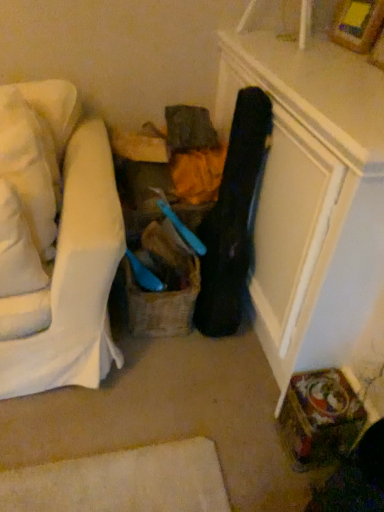
What are the coordinates of `black leather guitar case at center` in the screenshot? It's located at (232, 218).

What do you see at coordinates (357, 24) in the screenshot? The height and width of the screenshot is (512, 384). I see `wooden picture frame at upper right` at bounding box center [357, 24].

In order to face white soft pillow at left, which is the 1th pillow from back to front, should I rotate leftwards or rightwards?

Rotate your view left by about 20.834°.

The width and height of the screenshot is (384, 512). Describe the element at coordinates (17, 248) in the screenshot. I see `white fabric pillow at left, arranged as the first pillow when viewed from the front` at that location.

Find the location of a particular element. The height and width of the screenshot is (512, 384). black leather guitar case at center is located at coordinates (232, 218).

Is white soft pillow at left, which is the 1th pillow from back to front, in front of or behind wooden picture frame at upper right in the image?

In the image, white soft pillow at left, which is the 1th pillow from back to front, appears in front of wooden picture frame at upper right.

How different are the orientations of white soft pillow at left, placed as the 2th pillow when sorted from front to back, and wooden picture frame at upper right in degrees?

There is a 85.6-degree angle between the facing directions of white soft pillow at left, placed as the 2th pillow when sorted from front to back, and wooden picture frame at upper right.

Who is smaller, white soft pillow at left, which is the 1th pillow from back to front, or wooden picture frame at upper right?

With smaller size is wooden picture frame at upper right.

Would you say wooden picture frame at upper right is part of white soft pillow at left, placed as the 2th pillow when sorted from front to back,'s contents?

No, wooden picture frame at upper right is not inside white soft pillow at left, placed as the 2th pillow when sorted from front to back.

Is burlap basket at center smaller than white soft pillow at left, placed as the 2th pillow when sorted from front to back?

Indeed, burlap basket at center has a smaller size compared to white soft pillow at left, placed as the 2th pillow when sorted from front to back.

Is burlap basket at center inside the boundaries of white soft pillow at left, which is the 1th pillow from back to front, or outside?

burlap basket at center is not enclosed by white soft pillow at left, which is the 1th pillow from back to front.

Based on the photo, considering the positions of objects burlap basket at center and white soft pillow at left, placed as the 2th pillow when sorted from front to back, in the image provided, who is more to the left, burlap basket at center or white soft pillow at left, placed as the 2th pillow when sorted from front to back,?

From the viewer's perspective, white soft pillow at left, placed as the 2th pillow when sorted from front to back, appears more on the left side.

Looking at this image, from a real-world perspective, which object stands above the other?

From a 3D spatial view, white soft pillow at left, which is the 1th pillow from back to front, is above.

Considering the relative sizes of white fabric pillow at left, which ranks as the second pillow in back-to-front order, and black leather guitar case at center in the image provided, is white fabric pillow at left, which ranks as the second pillow in back-to-front order, smaller than black leather guitar case at center?

Correct, white fabric pillow at left, which ranks as the second pillow in back-to-front order, occupies less space than black leather guitar case at center.

From the image's perspective, is white fabric pillow at left, arranged as the first pillow when viewed from the front, located above black leather guitar case at center?

No, from the image's perspective, white fabric pillow at left, arranged as the first pillow when viewed from the front, is not over black leather guitar case at center.

Is white fabric pillow at left, arranged as the first pillow when viewed from the front, taller than black leather guitar case at center?

In fact, white fabric pillow at left, arranged as the first pillow when viewed from the front, may be shorter than black leather guitar case at center.

Between white fabric pillow at left, which ranks as the second pillow in back-to-front order, and black leather guitar case at center, which one appears on the left side from the viewer's perspective?

Positioned to the left is white fabric pillow at left, which ranks as the second pillow in back-to-front order.

Is black leather guitar case at center facing away from burlap basket at center?

No, black leather guitar case at center's orientation is not away from burlap basket at center.

Between black leather guitar case at center and burlap basket at center, which one has larger width?

burlap basket at center is wider.

Is black leather guitar case at center further to camera compared to burlap basket at center?

No, black leather guitar case at center is closer to the viewer.

Considering the sizes of objects black leather guitar case at center and burlap basket at center in the image provided, who is bigger, black leather guitar case at center or burlap basket at center?

With larger size is black leather guitar case at center.

Relative to black leather guitar case at center, is wooden picture frame at upper right in front or behind?

Visually, wooden picture frame at upper right is located behind black leather guitar case at center.

From a real-world perspective, which is physically below, wooden picture frame at upper right or black leather guitar case at center?

black leather guitar case at center is physically lower.

Considering the sizes of objects wooden picture frame at upper right and black leather guitar case at center in the image provided, who is thinner, wooden picture frame at upper right or black leather guitar case at center?

With smaller width is wooden picture frame at upper right.

Is wooden picture frame at upper right aimed at black leather guitar case at center?

No, wooden picture frame at upper right is not turned towards black leather guitar case at center.

From a real-world perspective, relative to white fabric pillow at left, which ranks as the second pillow in back-to-front order, is burlap basket at center vertically above or below?

From a real-world perspective, burlap basket at center is physically below white fabric pillow at left, which ranks as the second pillow in back-to-front order.

Which is more to the left, burlap basket at center or white fabric pillow at left, which ranks as the second pillow in back-to-front order?

white fabric pillow at left, which ranks as the second pillow in back-to-front order, is more to the left.

Is burlap basket at center touching white fabric pillow at left, arranged as the first pillow when viewed from the front?

No, burlap basket at center is not making contact with white fabric pillow at left, arranged as the first pillow when viewed from the front.

Which of these two, black leather guitar case at center or wooden picture frame at upper right, is thinner?

With smaller width is wooden picture frame at upper right.

Would you say black leather guitar case at center contains wooden picture frame at upper right?

No, wooden picture frame at upper right is not inside black leather guitar case at center.

Looking at this image, is black leather guitar case at center closer to the viewer compared to wooden picture frame at upper right?

Yes, it is in front of wooden picture frame at upper right.

The image size is (384, 512). Find the location of `picture frame that is on the right side of black leather guitar case at center`. picture frame that is on the right side of black leather guitar case at center is located at coordinates (357, 24).

You are a GUI agent. You are given a task and a screenshot of the screen. Output one action in this format:
    pyautogui.click(x=<x>, y=<y>)
    Task: Click on the picture frame behind the white soft pillow at left, which is the 1th pillow from back to front
    
    Given the screenshot: What is the action you would take?
    pyautogui.click(x=357, y=24)

I want to click on pillow that is the 2nd one when counting upward from the burlap basket at center (from the image's perspective), so click(30, 166).

Which object lies nearer to the anchor point white soft pillow at left, placed as the 2th pillow when sorted from front to back, white fabric pillow at left, which ranks as the second pillow in back-to-front order, or burlap basket at center?

Among the two, white fabric pillow at left, which ranks as the second pillow in back-to-front order, is located nearer to white soft pillow at left, placed as the 2th pillow when sorted from front to back.

Considering their positions, is white soft pillow at left, which is the 1th pillow from back to front, positioned further to wooden picture frame at upper right than black leather guitar case at center?

white soft pillow at left, which is the 1th pillow from back to front.

Which object lies nearer to the anchor point burlap basket at center, white fabric pillow at left, which ranks as the second pillow in back-to-front order, or black leather guitar case at center?

Based on the image, black leather guitar case at center appears to be nearer to burlap basket at center.

Estimate the real-world distances between objects in this image. Which object is closer to black leather guitar case at center, white fabric pillow at left, arranged as the first pillow when viewed from the front, or wooden picture frame at upper right?

The object closer to black leather guitar case at center is white fabric pillow at left, arranged as the first pillow when viewed from the front.

Based on their spatial positions, is white fabric pillow at left, arranged as the first pillow when viewed from the front, or white soft pillow at left, which is the 1th pillow from back to front, further from wooden picture frame at upper right?

white fabric pillow at left, arranged as the first pillow when viewed from the front, lies further to wooden picture frame at upper right than the other object.

Estimate the real-world distances between objects in this image. Which object is further from burlap basket at center, wooden picture frame at upper right or white soft pillow at left, which is the 1th pillow from back to front?

The object further to burlap basket at center is wooden picture frame at upper right.

Estimate the real-world distances between objects in this image. Which object is further from white soft pillow at left, placed as the 2th pillow when sorted from front to back, burlap basket at center or black leather guitar case at center?

The object further to white soft pillow at left, placed as the 2th pillow when sorted from front to back, is black leather guitar case at center.

Considering their positions, is white fabric pillow at left, which ranks as the second pillow in back-to-front order, positioned further to black leather guitar case at center than burlap basket at center?

white fabric pillow at left, which ranks as the second pillow in back-to-front order.

Where is `basket located between white soft pillow at left, which is the 1th pillow from back to front, and wooden picture frame at upper right in the left-right direction`? This screenshot has width=384, height=512. basket located between white soft pillow at left, which is the 1th pillow from back to front, and wooden picture frame at upper right in the left-right direction is located at coordinates (161, 305).

The width and height of the screenshot is (384, 512). I want to click on clothing located between white fabric pillow at left, arranged as the first pillow when viewed from the front, and wooden picture frame at upper right in the left-right direction, so click(x=232, y=218).

This screenshot has height=512, width=384. In order to click on clothing between white soft pillow at left, which is the 1th pillow from back to front, and wooden picture frame at upper right from left to right in this screenshot , I will do `click(232, 218)`.

The height and width of the screenshot is (512, 384). Find the location of `pillow located between white soft pillow at left, which is the 1th pillow from back to front, and wooden picture frame at upper right in the left-right direction`. pillow located between white soft pillow at left, which is the 1th pillow from back to front, and wooden picture frame at upper right in the left-right direction is located at coordinates (17, 248).